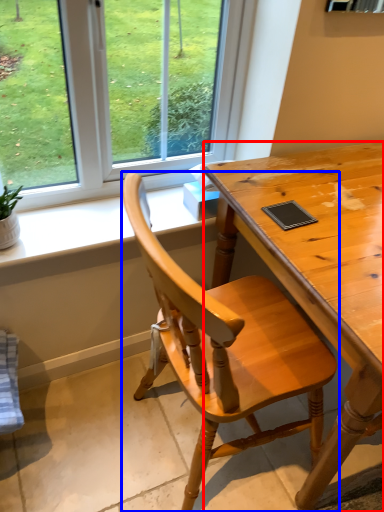
Question: Which object appears farthest to the camera in this image, desk (highlighted by a red box) or chair (highlighted by a blue box)?

Choices:
 (A) desk
 (B) chair

Answer: (A)